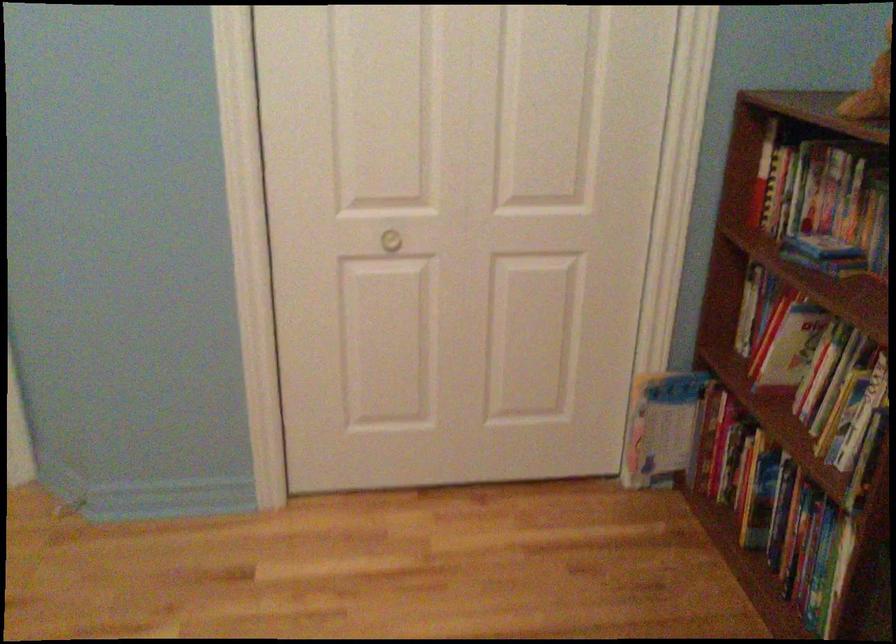
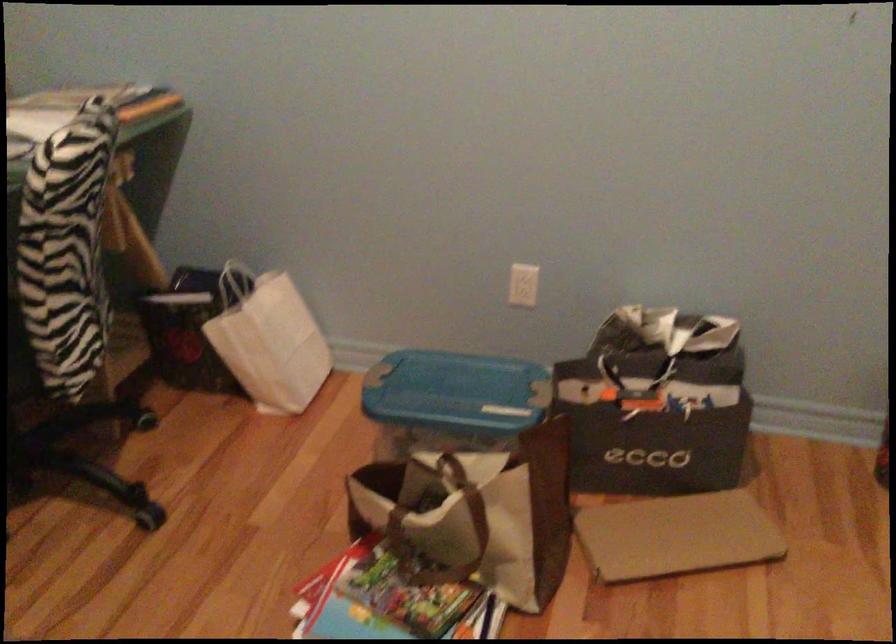
How did the camera likely rotate?

The camera rotated toward left-down.